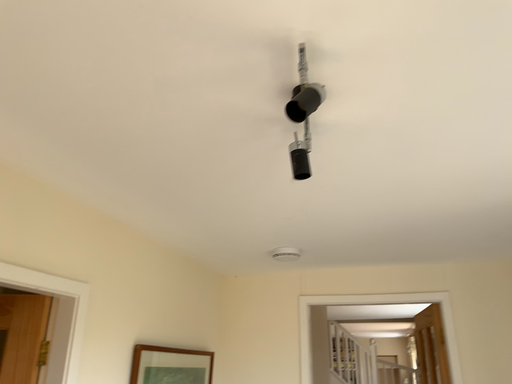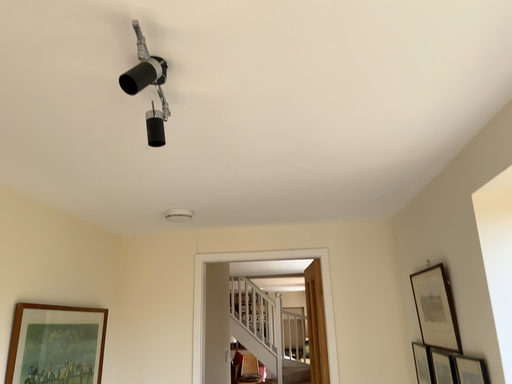
Question: Which way did the camera rotate in the video?

Choices:
 (A) rotated right
 (B) rotated left

Answer: (A)